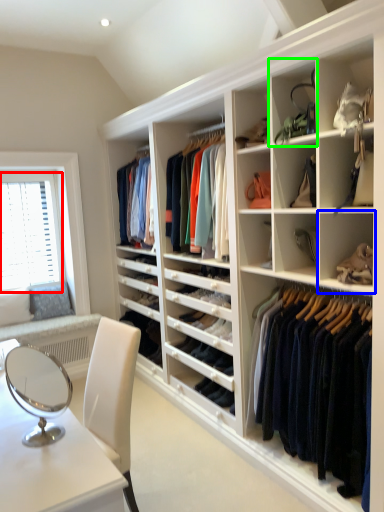
Question: Which is nearer to the window screen (highlighted by a red box)? shelf (highlighted by a blue box) or shelf (highlighted by a green box).

Choices:
 (A) shelf
 (B) shelf

Answer: (B)